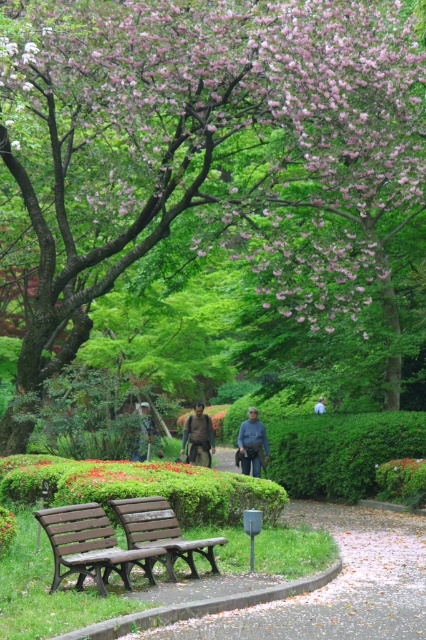
Is wooden bench at lower left wider than dark gray fabric jacket at center?

Correct, the width of wooden bench at lower left exceeds that of dark gray fabric jacket at center.

Can you confirm if wooden bench at lower left is taller than dark gray fabric jacket at center?

No.

Where is `wooden bench at lower left`? Image resolution: width=426 pixels, height=640 pixels. wooden bench at lower left is located at coordinates (91, 545).

The width and height of the screenshot is (426, 640). Find the location of `wooden bench at lower left`. wooden bench at lower left is located at coordinates (91, 545).

Between point (249, 424) and point (321, 408), which one is positioned behind?

The point (321, 408) is more distant.

Is brown leather jacket at center positioned before light brown leather jacket at center?

Yes, it is in front of light brown leather jacket at center.

Is point (236, 460) positioned behind point (319, 406)?

No.

This screenshot has height=640, width=426. I want to click on brown leather jacket at center, so click(253, 444).

Between green leafy tree at center and light brown leather jacket at center, which one has less height?

light brown leather jacket at center

Is green leafy tree at center below light brown leather jacket at center?

No.

Measure the distance between point (x=219, y=186) and camera.

The distance of point (x=219, y=186) from camera is 21.70 meters.

In order to click on green leafy tree at center in this screenshot , I will do `click(209, 150)`.